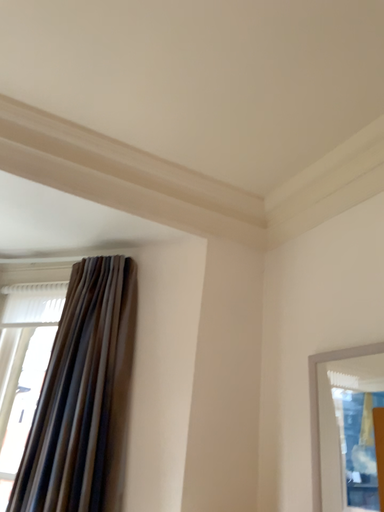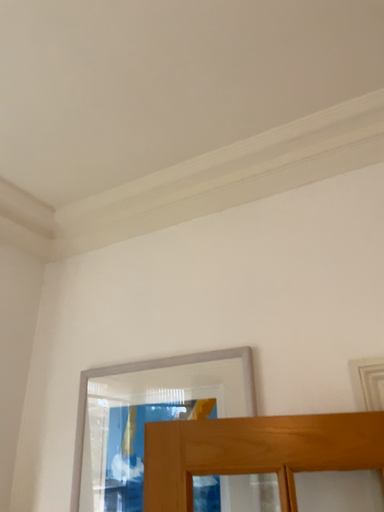
Question: How did the camera likely rotate when shooting the video?

Choices:
 (A) rotated right
 (B) rotated left

Answer: (A)